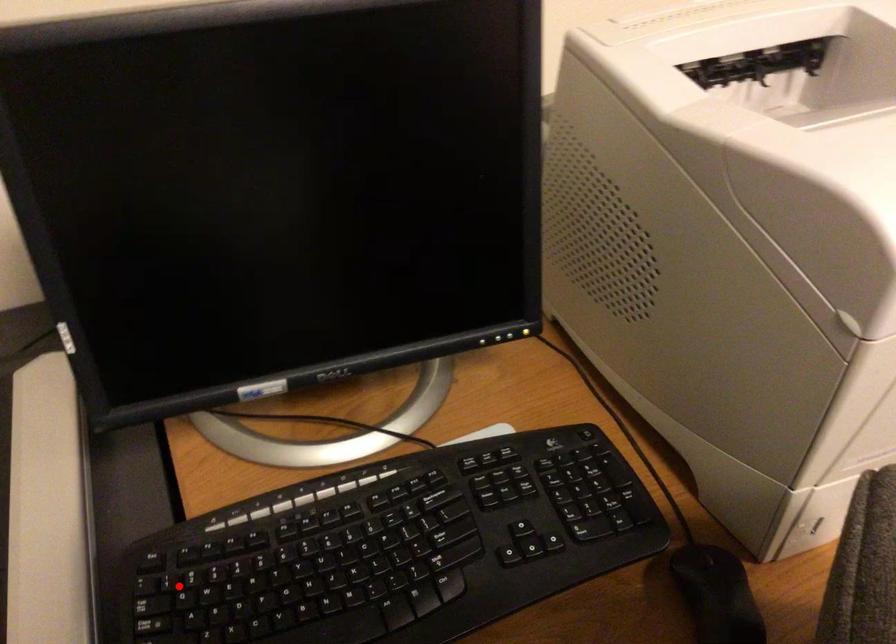
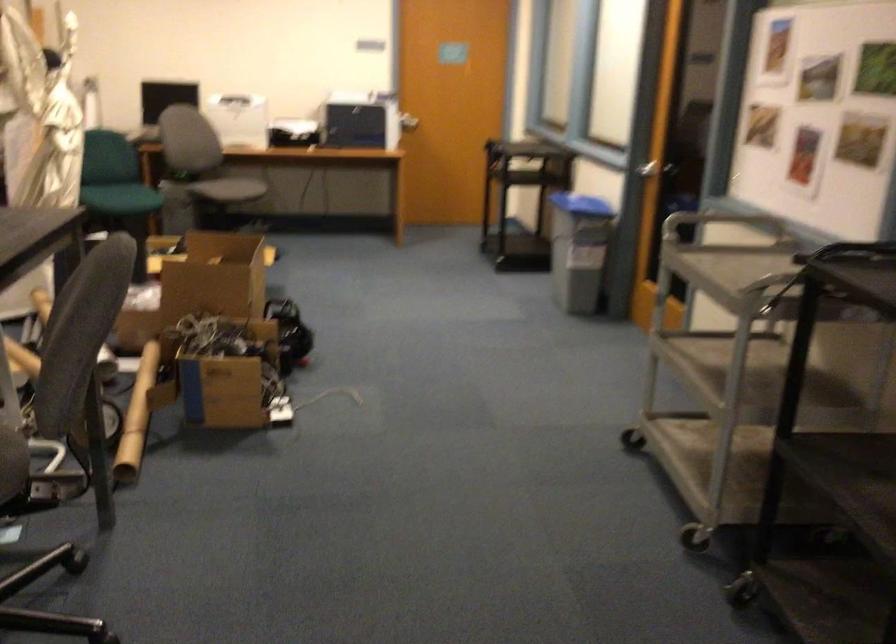
Question: I am providing you with two images of the same scene from different viewpoints. A red point is marked on the first image. At the location where the point appears in image 1, is it still visible in image 2?

Choices:
 (A) Yes
 (B) No

Answer: (B)